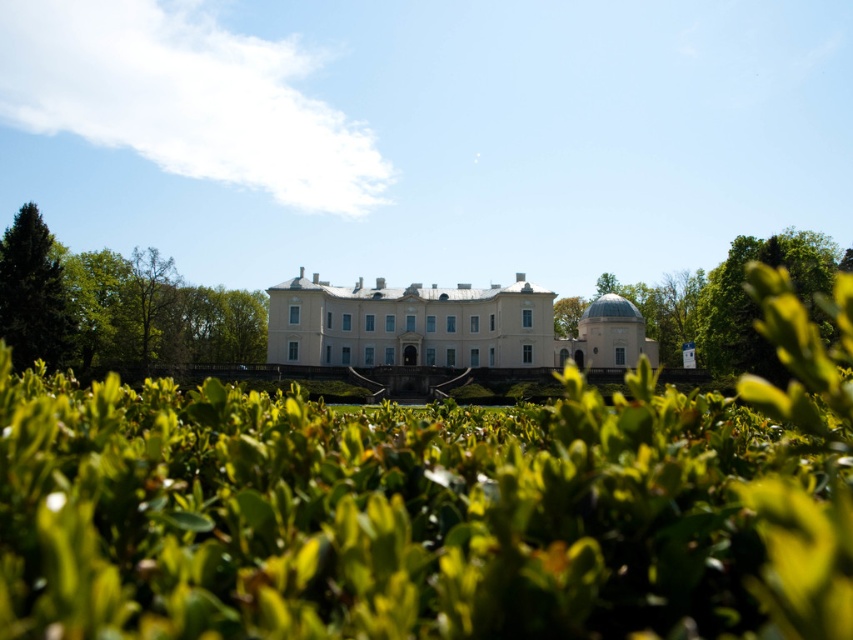
Which is more to the right, green leafy hedge at center or green leafy bush at right?

From the viewer's perspective, green leafy bush at right appears more on the right side.

Between green leafy hedge at center and green leafy bush at right, which one is positioned higher?

green leafy bush at right

The image size is (853, 640). What do you see at coordinates (410, 516) in the screenshot?
I see `green leafy hedge at center` at bounding box center [410, 516].

The width and height of the screenshot is (853, 640). In order to click on green leafy hedge at center in this screenshot , I will do `click(410, 516)`.

Which is more to the right, green leafy hedge at center or white smooth palace at center?

Positioned to the right is white smooth palace at center.

This screenshot has height=640, width=853. Describe the element at coordinates (410, 516) in the screenshot. I see `green leafy hedge at center` at that location.

Image resolution: width=853 pixels, height=640 pixels. In order to click on green leafy hedge at center in this screenshot , I will do [410, 516].

Locate an element on the screen. green leafy bush at right is located at coordinates (734, 301).

Does point (641, 308) come farther from viewer compared to point (51, 342)?

Yes, point (641, 308) is farther from viewer.

Locate an element on the screen. green leafy bush at right is located at coordinates tap(734, 301).